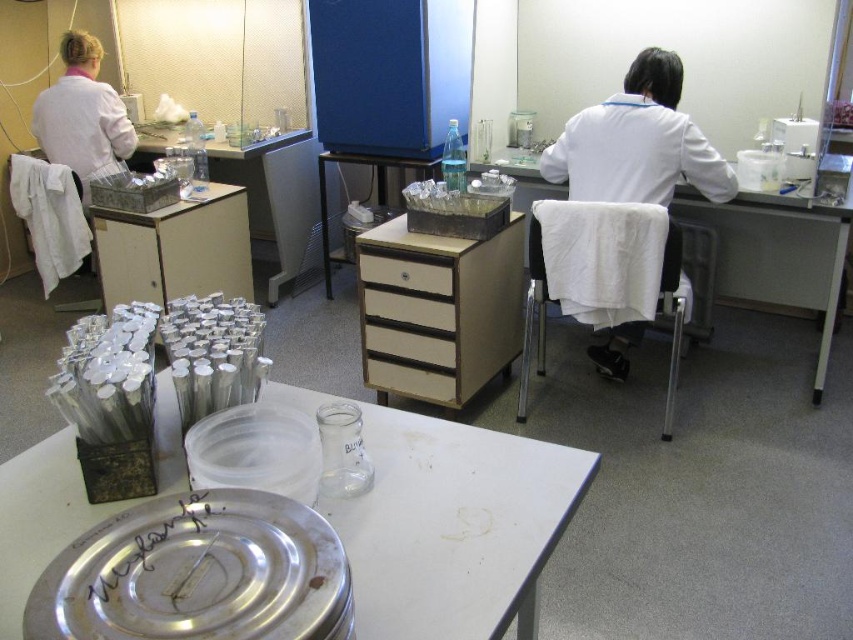
Question: Considering the relative positions of metallic silver tray at center and beige matte drawer at center in the image provided, where is metallic silver tray at center located with respect to beige matte drawer at center?

Choices:
 (A) above
 (B) below

Answer: (A)

Question: Which point is closer to the camera taking this photo?

Choices:
 (A) (422, 266)
 (B) (320, 192)

Answer: (A)

Question: Considering the relative positions of beige cardboard drawer at center and beige matte drawer at center in the image provided, where is beige cardboard drawer at center located with respect to beige matte drawer at center?

Choices:
 (A) below
 (B) above

Answer: (B)

Question: Which object is farther from the camera taking this photo?

Choices:
 (A) white lab coat at left
 (B) white fabric-covered chair at right

Answer: (A)

Question: Does white matte lab coat at center appear on the left side of beige matte drawer at center?

Choices:
 (A) no
 (B) yes

Answer: (A)

Question: Which of these objects is positioned closest to the beige cardboard drawer at center?

Choices:
 (A) white matte drawer at center
 (B) metallic silver plate at center
 (C) white fabric-covered chair at right

Answer: (A)